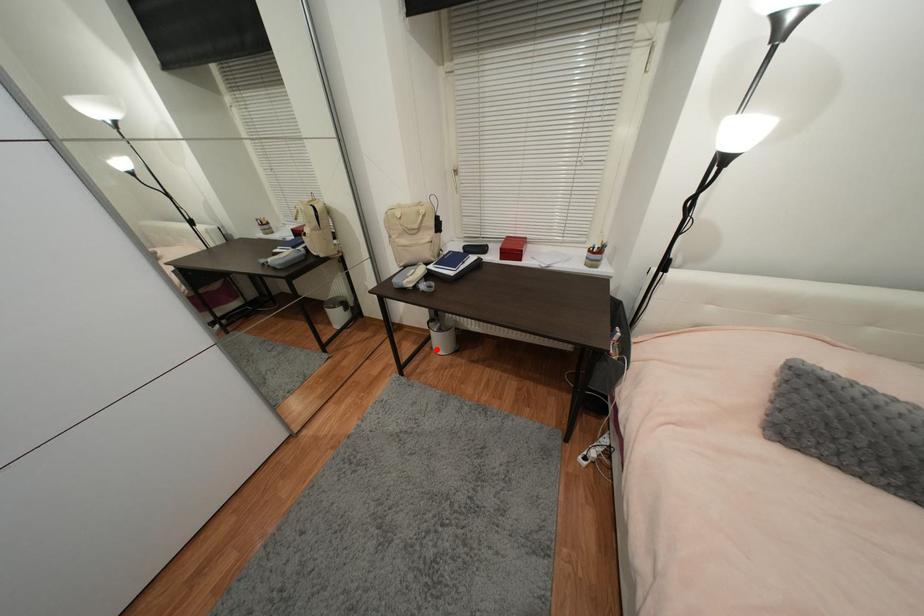
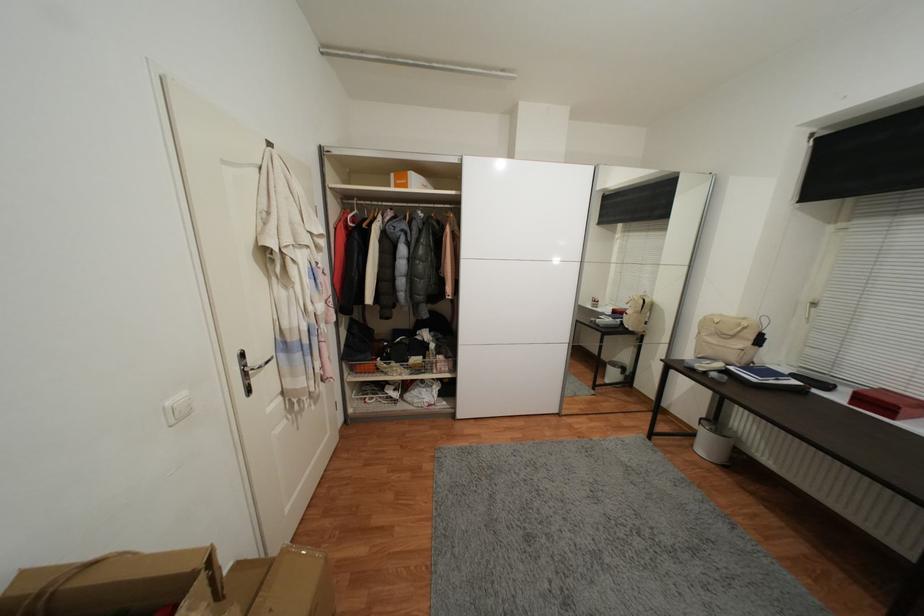
Where in the second image is the point corresponding to the highlighted location from the first image?

(697, 447)